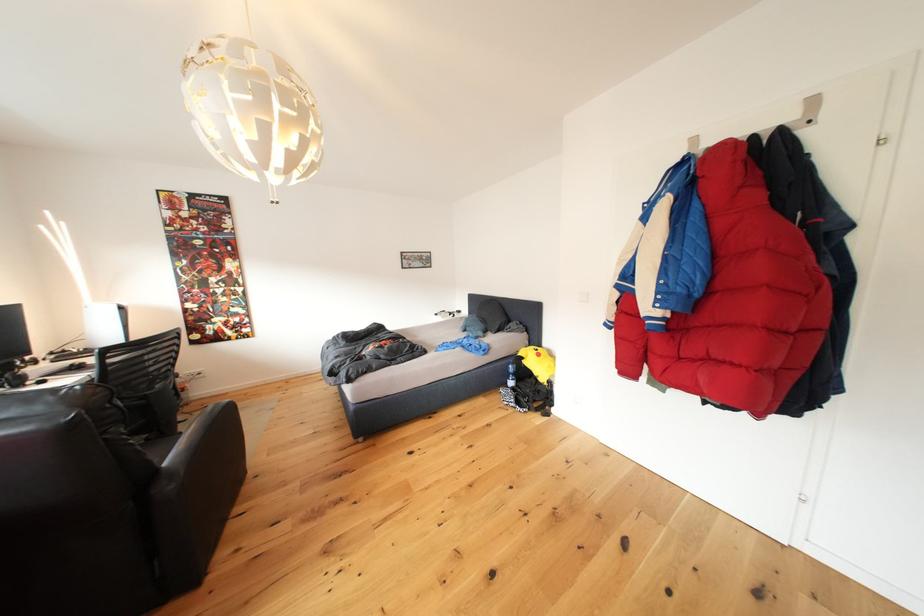
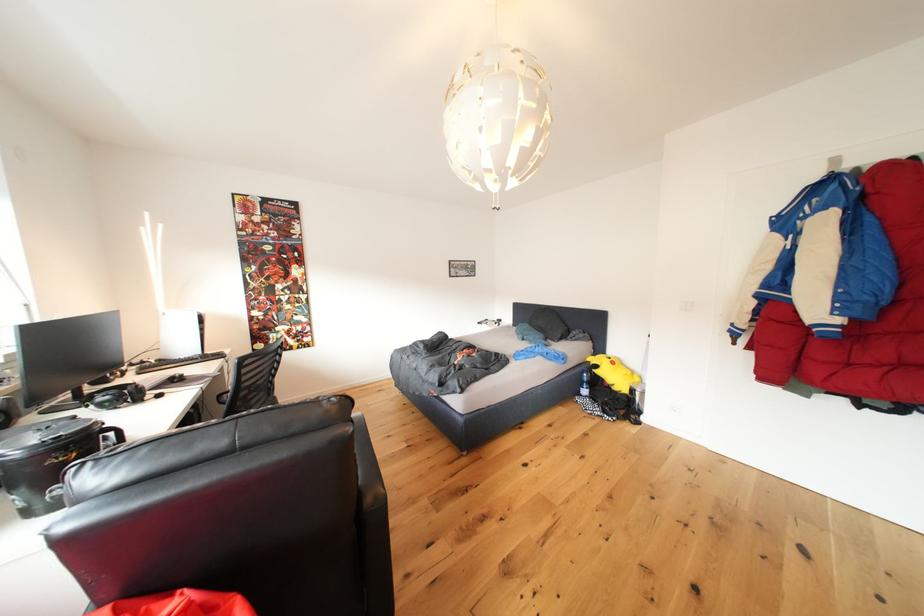
Question: What movement of the cameraman would produce the second image?

Choices:
 (A) Left
 (B) Right
 (C) Forward
 (D) Backward

Answer: (A)